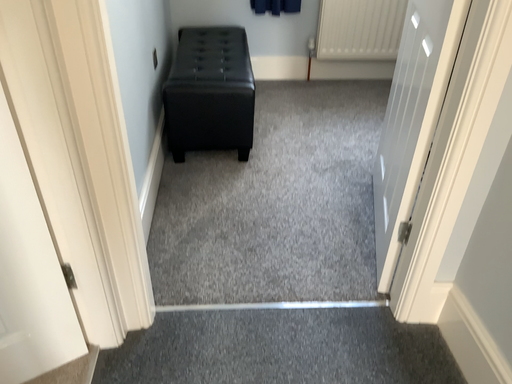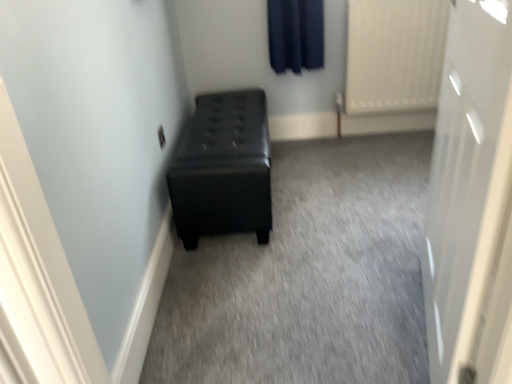
Question: How did the camera likely rotate when shooting the video?

Choices:
 (A) rotated right
 (B) rotated left

Answer: (B)